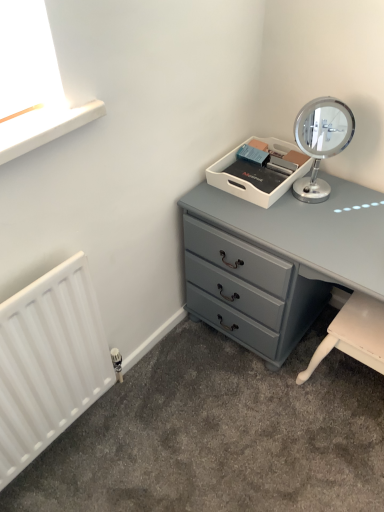
Identify the location of vacant space in between polished chrome mirror at upper right and white plastic tray at upper center. tap(305, 199).